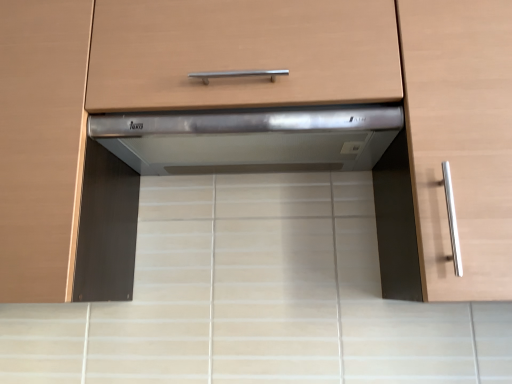
Question: From a real-world perspective, is satin silver metallic range hood at center, marked as the 1th cabinetry in a left-to-right arrangement, positioned above or below satin silver range hood at center?

Choices:
 (A) above
 (B) below

Answer: (A)

Question: From the image's perspective, is satin silver metallic range hood at center, the second cabinetry viewed from the right, located above or below satin silver range hood at center?

Choices:
 (A) below
 (B) above

Answer: (B)

Question: Which is farther from the satin silver range hood at center?

Choices:
 (A) satin wood cabinet handle at right, arranged as the second cabinetry when viewed from the left
 (B) satin silver drawer at center
 (C) satin silver metallic range hood at center, the second cabinetry viewed from the right

Answer: (C)

Question: Estimate the real-world distances between objects in this image. Which object is farther from the satin silver drawer at center?

Choices:
 (A) satin wood cabinet handle at right, the 1th cabinetry when ordered from right to left
 (B) satin silver metallic range hood at center, the second cabinetry viewed from the right
 (C) satin silver range hood at center

Answer: (A)